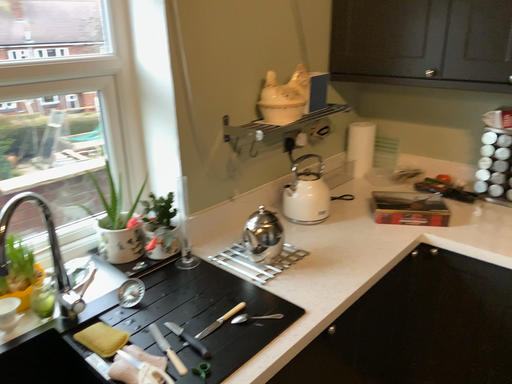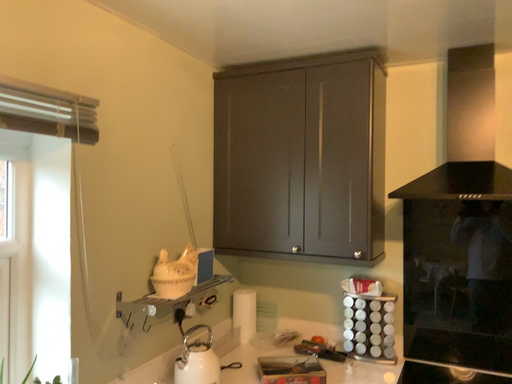
Question: Which way did the camera rotate in the video?

Choices:
 (A) rotated left
 (B) rotated right

Answer: (B)